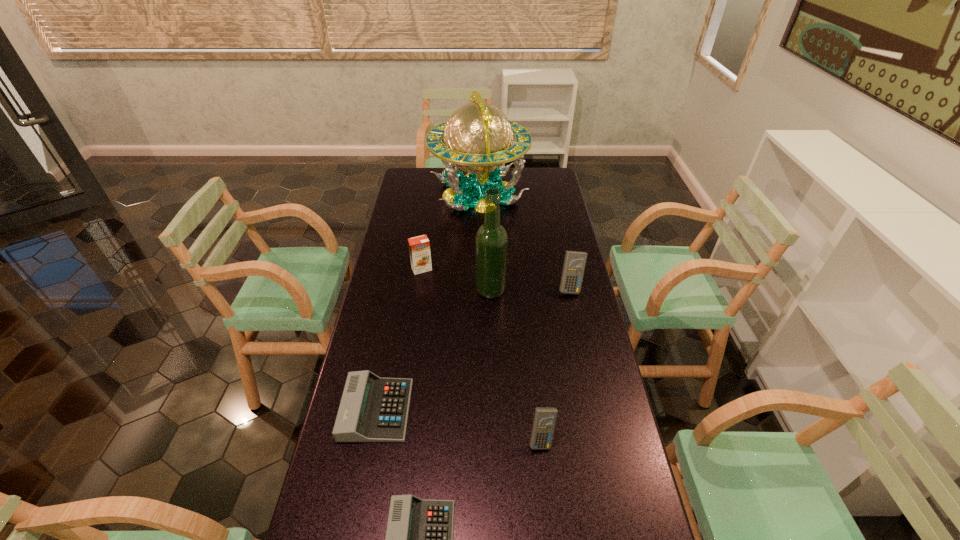
Identify the location of empty space between the liquor and the sixth nearest object. (456, 279).

The width and height of the screenshot is (960, 540). Find the location of `vacant space that's between the third tallest calculator and the liquor`. vacant space that's between the third tallest calculator and the liquor is located at coordinates (434, 350).

Find the location of a particular element. This screenshot has width=960, height=540. object that stands as the second closest to the shortest calculator is located at coordinates (544, 421).

This screenshot has height=540, width=960. Find the location of `the fourth closest object to the sixth tallest object`. the fourth closest object to the sixth tallest object is located at coordinates click(x=419, y=247).

Choose which calculator is the nearest neighbor to the rightmost calculator. Please provide its 2D coordinates. Your answer should be formatted as a tuple, i.e. [(x, y)], where the tuple contains the x and y coordinates of a point satisfying the conditions above.

[(544, 421)]

Select which calculator appears as the third closest to the smaller blue calculator. Please provide its 2D coordinates. Your answer should be formatted as a tuple, i.e. [(x, y)], where the tuple contains the x and y coordinates of a point satisfying the conditions above.

[(574, 264)]

Image resolution: width=960 pixels, height=540 pixels. Find the location of `gray calculator that is the closest to the second farthest object`. gray calculator that is the closest to the second farthest object is located at coordinates (372, 409).